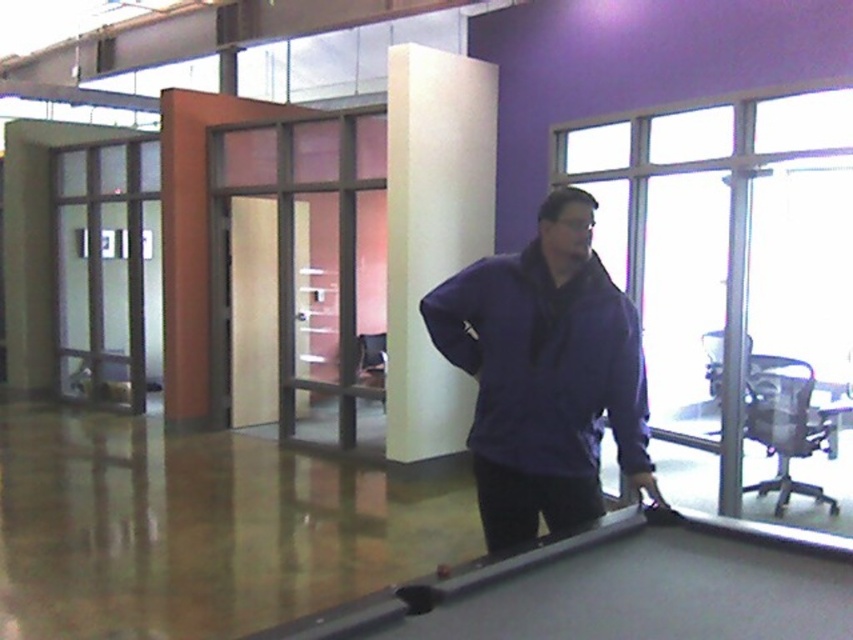
Which is behind, point (527, 296) or point (410, 451)?

The point (410, 451) is more distant.

At what (x,y) coordinates should I click in order to perform the action: click on purple matte jacket at center. Please return your answer as a coordinate pair (x, y). The width and height of the screenshot is (853, 640). Looking at the image, I should click on (544, 374).

Which is behind, point (492, 582) or point (410, 109)?

The point (410, 109) is more distant.

Which is below, smooth black pool table at center or white matte pillar at center?

smooth black pool table at center is below.

Which is behind, point (759, 577) or point (451, 221)?

The point (451, 221) is behind.

Locate an element on the screen. smooth black pool table at center is located at coordinates (618, 588).

Between point (498, 273) and point (694, 616), which one is positioned in front?

Point (694, 616) is in front.

Is point (549, 461) positioned behind point (697, 572)?

Yes, it is behind point (697, 572).

In order to click on purple matte jacket at center in this screenshot , I will do `click(544, 374)`.